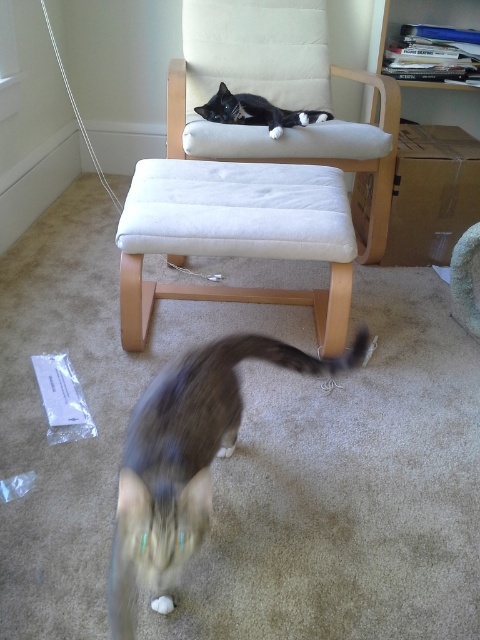
Question: Estimate the real-world distances between objects in this image. Which object is farther from the black and white fur cat at upper center?

Choices:
 (A) tabby fur cat at lower center
 (B) white fabric stool at center

Answer: (A)

Question: Can you confirm if white fabric stool at center is wider than tabby fur cat at lower center?

Choices:
 (A) yes
 (B) no

Answer: (A)

Question: Which point is closer to the camera?

Choices:
 (A) (314, 22)
 (B) (324, 118)
 (C) (245, 353)
 (D) (323, 228)

Answer: (C)

Question: Is white fabric stool at center to the left of tabby fur cat at lower center from the viewer's perspective?

Choices:
 (A) no
 (B) yes

Answer: (B)

Question: Which of the following is the farthest from the observer?

Choices:
 (A) (266, 104)
 (B) (222, 22)
 (C) (322, 301)
 (D) (136, 534)

Answer: (B)

Question: Does beige fabric armchair at upper center appear on the right side of white fabric stool at center?

Choices:
 (A) no
 (B) yes

Answer: (B)